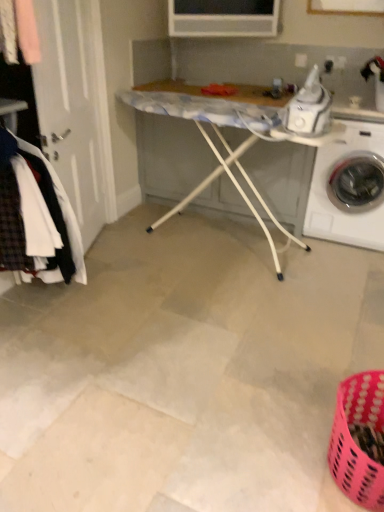
The width and height of the screenshot is (384, 512). What are the coordinates of `free point in front of white plastic ironing board at center` in the screenshot? It's located at (210, 322).